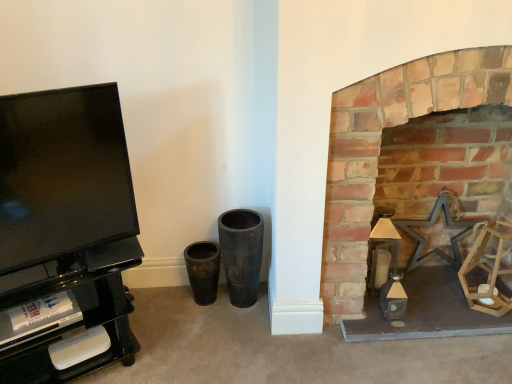
Image resolution: width=512 pixels, height=384 pixels. Identify the location of brick fireplace at right. (380, 148).

What is the approximate width of brick fireplace at right?

It is 16.78 inches.

What do you see at coordinates (380, 148) in the screenshot? The width and height of the screenshot is (512, 384). I see `brick fireplace at right` at bounding box center [380, 148].

This screenshot has width=512, height=384. What are the coordinates of `black glossy tv stand at left` in the screenshot? It's located at (65, 232).

Describe the element at coordinates (65, 232) in the screenshot. I see `black glossy tv stand at left` at that location.

In order to face black glossy tv stand at left, should I rotate leftwards or rightwards?

You should look left and rotate roughly 24.353 degrees.

Find the location of `brick fireplace at right`. brick fireplace at right is located at coordinates (380, 148).

Is brick fireplace at right to the left or to the right of black glossy tv stand at left in the image?

In the image, brick fireplace at right appears on the right side of black glossy tv stand at left.

Which object is more forward, brick fireplace at right or black glossy tv stand at left?

black glossy tv stand at left is in front.

Does point (344, 223) lie behind point (106, 186)?

Yes, it is behind point (106, 186).

From the image's perspective, who appears lower, brick fireplace at right or black glossy tv stand at left?

From the image's view, black glossy tv stand at left is below.

Consider the image. From a real-world perspective, is brick fireplace at right positioned above or below black glossy tv stand at left?

Clearly, from a real-world perspective, brick fireplace at right is below black glossy tv stand at left.

Is brick fireplace at right thinner than black glossy tv stand at left?

No, brick fireplace at right is not thinner than black glossy tv stand at left.

From their relative heights in the image, would you say brick fireplace at right is taller or shorter than black glossy tv stand at left?

In the image, brick fireplace at right appears to be taller than black glossy tv stand at left.

Considering the sizes of objects brick fireplace at right and black glossy tv stand at left in the image provided, who is bigger, brick fireplace at right or black glossy tv stand at left?

brick fireplace at right.

Can we say brick fireplace at right lies outside black glossy tv stand at left?

brick fireplace at right lies outside black glossy tv stand at left's area.

Is brick fireplace at right positioned far away from black glossy tv stand at left?

No.

Does brick fireplace at right turn towards black glossy tv stand at left?

No, brick fireplace at right is not turned towards black glossy tv stand at left.

Locate an element on the screen. This screenshot has height=384, width=512. entertainment center located above the brick fireplace at right (from a real-world perspective) is located at coordinates (65, 232).

Considering the positions of objects black glossy tv stand at left and brick fireplace at right in the image provided, who is more to the right, black glossy tv stand at left or brick fireplace at right?

From the viewer's perspective, brick fireplace at right appears more on the right side.

Which object is closer to the camera, black glossy tv stand at left or brick fireplace at right?

black glossy tv stand at left is in front.

Which point is more distant from viewer, (x=115, y=320) or (x=375, y=138)?

Positioned behind is point (x=115, y=320).

From the image's perspective, is black glossy tv stand at left above or below brick fireplace at right?

black glossy tv stand at left is below brick fireplace at right.

From a real-world perspective, is black glossy tv stand at left over brick fireplace at right?

Yes, from a real-world perspective, black glossy tv stand at left is on top of brick fireplace at right.

Looking at their sizes, would you say black glossy tv stand at left is wider or thinner than brick fireplace at right?

Clearly, black glossy tv stand at left has less width compared to brick fireplace at right.

Considering the sizes of objects black glossy tv stand at left and brick fireplace at right in the image provided, who is taller, black glossy tv stand at left or brick fireplace at right?

With more height is brick fireplace at right.

Considering the sizes of objects black glossy tv stand at left and brick fireplace at right in the image provided, who is smaller, black glossy tv stand at left or brick fireplace at right?

Smaller between the two is black glossy tv stand at left.

Is brick fireplace at right completely or partially inside black glossy tv stand at left?

No, brick fireplace at right is not surrounded by black glossy tv stand at left.

Is black glossy tv stand at left placed right next to brick fireplace at right?

black glossy tv stand at left and brick fireplace at right are clearly separated.

Based on the photo, is brick fireplace at right at the back of black glossy tv stand at left?

black glossy tv stand at left is not turned away from brick fireplace at right.

Can you tell me how much black glossy tv stand at left and brick fireplace at right differ in facing direction?

black glossy tv stand at left and brick fireplace at right are facing 31.4 degrees away from each other.

Identify the location of fireplace below the black glossy tv stand at left (from a real-world perspective). (380, 148).

The width and height of the screenshot is (512, 384). Identify the location of fireplace below the black glossy tv stand at left (from a real-world perspective). pyautogui.click(x=380, y=148).

Where is `fireplace on the right side of black glossy tv stand at left`? fireplace on the right side of black glossy tv stand at left is located at coordinates click(x=380, y=148).